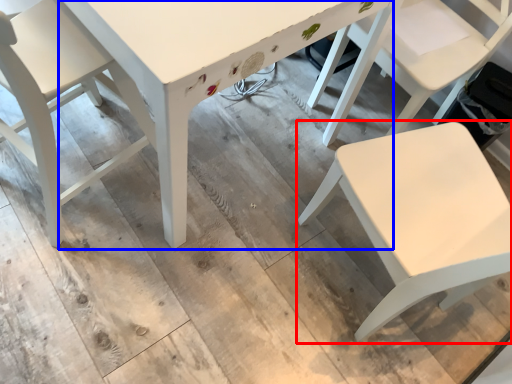
Question: Among these objects, which one is nearest to the camera, chair (highlighted by a red box) or table (highlighted by a blue box)?

Choices:
 (A) chair
 (B) table

Answer: (A)